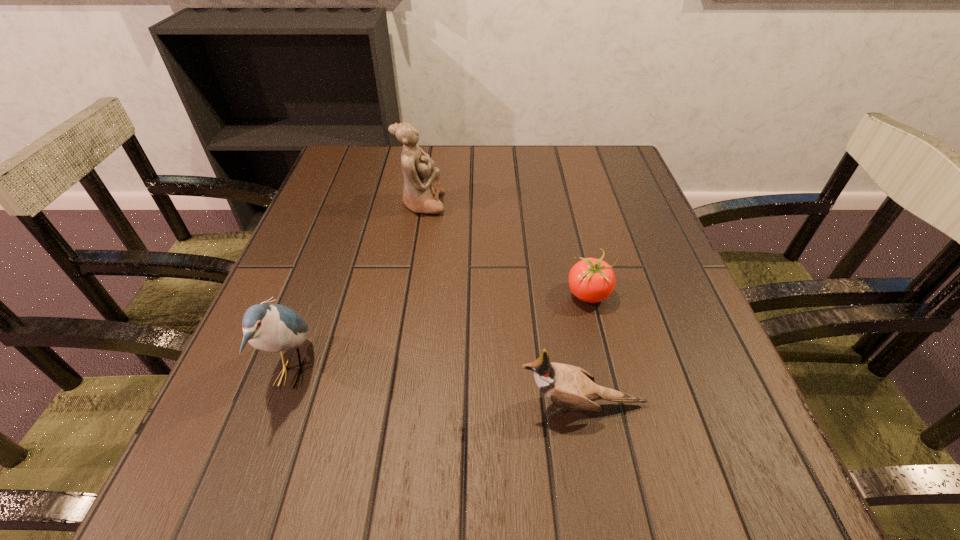
This screenshot has height=540, width=960. Identify the location of free space that satisfies the following two spatial constraints: 1. on the front-facing side of the farthest object; 2. on the back side of the shortest object. (407, 294).

The height and width of the screenshot is (540, 960). In order to click on free space that satisfies the following two spatial constraints: 1. on the front-facing side of the figurine; 2. on the back side of the third nearest object in this screenshot , I will do `click(407, 294)`.

Locate an element on the screen. The width and height of the screenshot is (960, 540). free space that satisfies the following two spatial constraints: 1. on the front-facing side of the third nearest object; 2. on the left side of the third object from right to left is located at coordinates (407, 294).